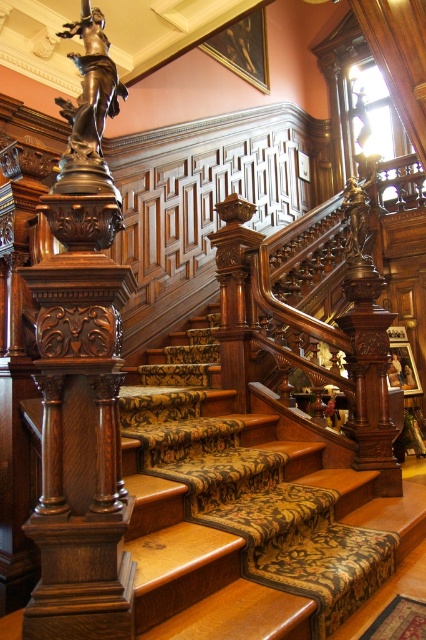
Question: Does bronze/carved wood pillar at left have a lesser width compared to bronze statue at upper left?

Choices:
 (A) yes
 (B) no

Answer: (B)

Question: Is bronze/carved wood pillar at left to the left of bronze statue at upper left from the viewer's perspective?

Choices:
 (A) yes
 (B) no

Answer: (A)

Question: Does bronze/carved wood pillar at left appear on the right side of bronze statue at upper left?

Choices:
 (A) no
 (B) yes

Answer: (A)

Question: Which of the following is the closest to the observer?

Choices:
 (A) (78, 104)
 (B) (111, 392)

Answer: (B)

Question: Which point is farther to the camera?

Choices:
 (A) bronze statue at upper left
 (B) bronze/carved wood pillar at left

Answer: (A)